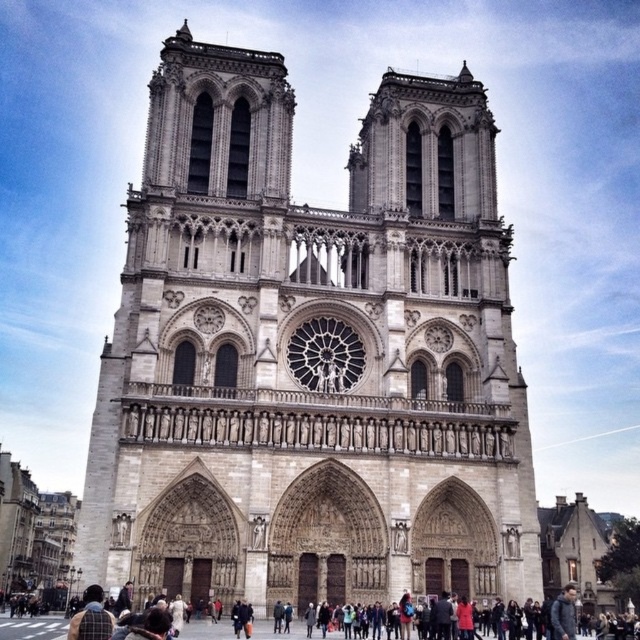
You are a tourist visiting the Notre Dame Cathedral. You see the stone cathedral at center and the dark gray coat at lower center. Which object is bigger in size?

The stone cathedral at center is larger in size compared to the dark gray coat at lower center.